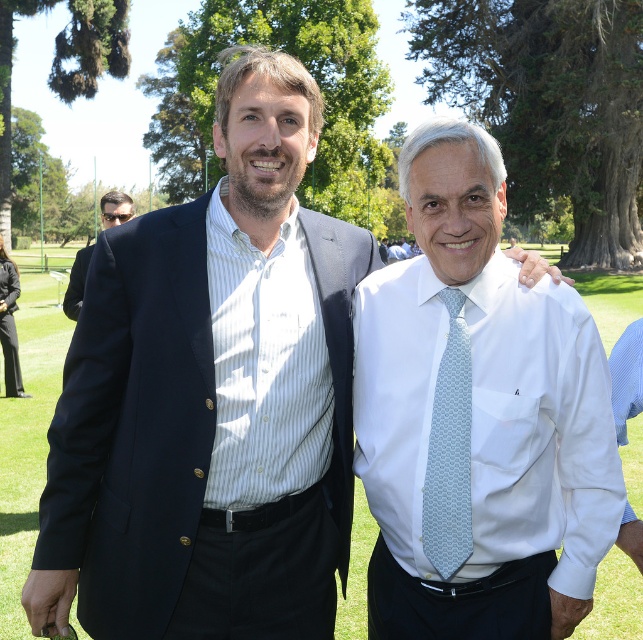
Is white silk shirt at center below sunglasses at left?

Indeed, white silk shirt at center is positioned under sunglasses at left.

Is point (428, 262) in front of point (107, 193)?

Yes, point (428, 262) is closer to viewer.

I want to click on white silk shirt at center, so click(476, 419).

Where is `white silk shirt at center`? This screenshot has height=640, width=643. white silk shirt at center is located at coordinates (476, 419).

Who is more forward, (64, 300) or (77, 253)?

Point (64, 300) is more forward.

Does sunglasses at left have a greater width compared to dark blue wool suit at left?

Yes.

Does point (105, 205) lie behind point (75, 308)?

Yes, point (105, 205) is farther from viewer.

The image size is (643, 640). I want to click on sunglasses at left, so click(x=77, y=282).

Can you confirm if white silk shirt at center is positioned below dark blue wool suit at left?

Indeed, white silk shirt at center is positioned under dark blue wool suit at left.

Does point (493, 490) come in front of point (69, 316)?

Yes, it is.

I want to click on white silk shirt at center, so click(x=476, y=419).